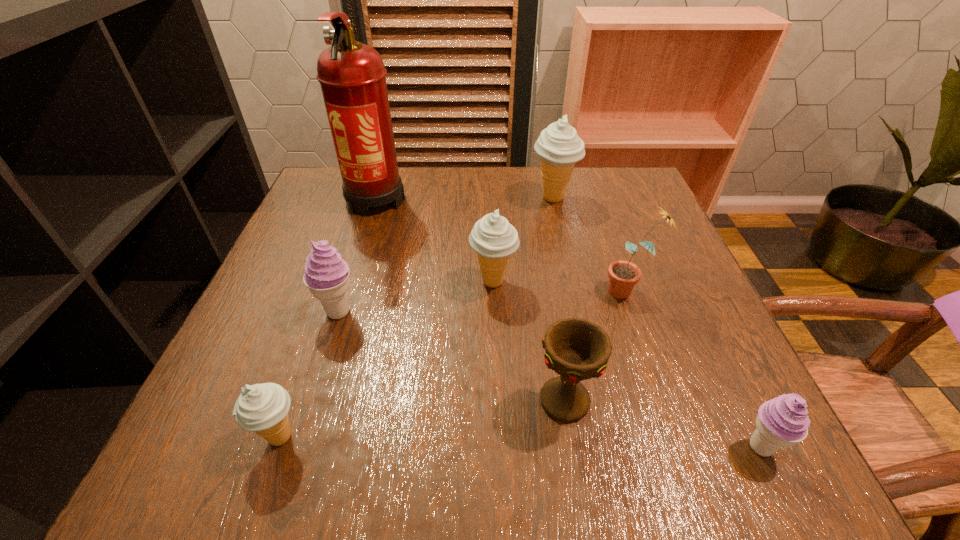
Locate which object ranks third in proximity to the smallest beige icecream. Please provide its 2D coordinates. Your answer should be formatted as a tuple, i.e. [(x, y)], where the tuple contains the x and y coordinates of a point satisfying the conditions above.

[(577, 349)]

Locate an element on the screen. the sixth closest object relative to the second icecream from right to left is located at coordinates (781, 422).

The height and width of the screenshot is (540, 960). I want to click on icecream that is the fourth closest to the smallest beige icecream, so click(x=559, y=147).

Identify the location of icecream that can be found as the third closest to the left purple icecream. This screenshot has width=960, height=540. (559, 147).

Locate which beige icecream ranks second in proximity to the tallest object. Please provide its 2D coordinates. Your answer should be formatted as a tuple, i.e. [(x, y)], where the tuple contains the x and y coordinates of a point satisfying the conditions above.

[(559, 147)]

Identify which beige icecream is located as the nearest to the bigger purple icecream. Please provide its 2D coordinates. Your answer should be formatted as a tuple, i.e. [(x, y)], where the tuple contains the x and y coordinates of a point satisfying the conditions above.

[(263, 408)]

Find the location of a particular element. This screenshot has width=960, height=540. vacant area that satisfies the following two spatial constraints: 1. on the front-facing side of the second biggest beige icecream; 2. on the right side of the red fire extinguisher is located at coordinates (349, 281).